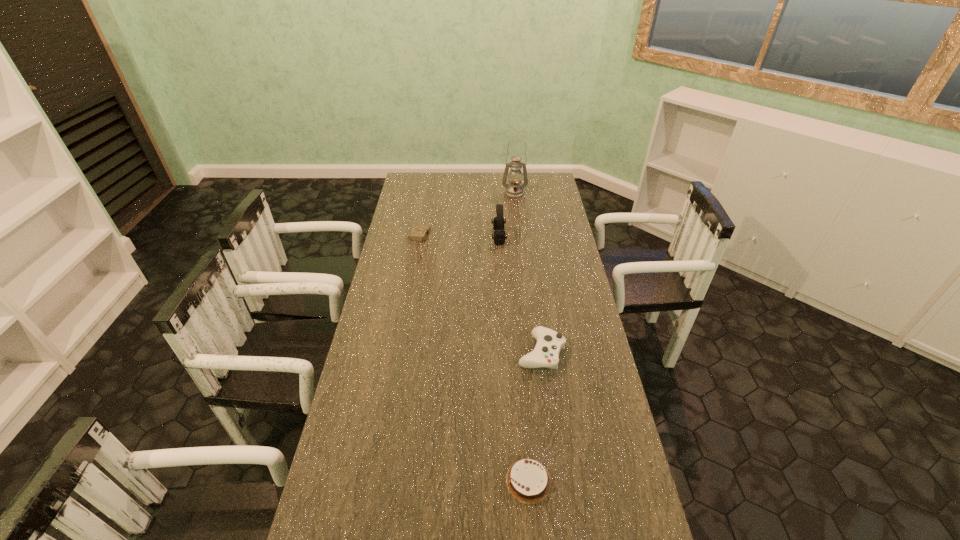
Where is `vacant space that is in between the chocolate cake and the second nearest object`? vacant space that is in between the chocolate cake and the second nearest object is located at coordinates (535, 416).

Choose which object is the second nearest neighbor to the chocolate cake. Please provide its 2D coordinates. Your answer should be formatted as a tuple, i.e. [(x, y)], where the tuple contains the x and y coordinates of a point satisfying the conditions above.

[(498, 222)]

I want to click on the fourth closest object relative to the control, so click(x=514, y=190).